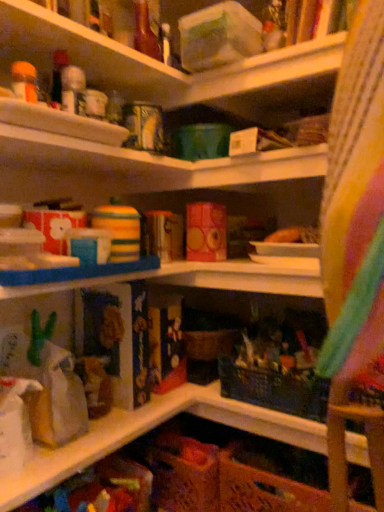
Question: Is brown paper bag at lower left shorter than orange woven basket at lower center?

Choices:
 (A) yes
 (B) no

Answer: (A)

Question: Considering the relative positions of brown paper bag at lower left and orange woven basket at lower center in the image provided, is brown paper bag at lower left to the left of orange woven basket at lower center from the viewer's perspective?

Choices:
 (A) no
 (B) yes

Answer: (B)

Question: Does brown paper bag at lower left have a larger size compared to orange woven basket at lower center?

Choices:
 (A) no
 (B) yes

Answer: (A)

Question: Is brown paper bag at lower left next to orange woven basket at lower center and touching it?

Choices:
 (A) no
 (B) yes

Answer: (A)

Question: Does brown paper bag at lower left have a smaller size compared to orange woven basket at lower center?

Choices:
 (A) yes
 (B) no

Answer: (A)

Question: Is brown paper bag at lower left further to camera compared to orange woven basket at lower center?

Choices:
 (A) no
 (B) yes

Answer: (A)

Question: Are orange woven basket at lower center and brown paper bag at lower left far apart?

Choices:
 (A) yes
 (B) no

Answer: (B)

Question: Does orange woven basket at lower center have a smaller size compared to brown paper bag at lower left?

Choices:
 (A) no
 (B) yes

Answer: (A)

Question: Is orange woven basket at lower center to the right of brown paper bag at lower left from the viewer's perspective?

Choices:
 (A) no
 (B) yes

Answer: (B)

Question: Is orange woven basket at lower center positioned in front of brown paper bag at lower left?

Choices:
 (A) yes
 (B) no

Answer: (B)

Question: Does orange woven basket at lower center have a greater width compared to brown paper bag at lower left?

Choices:
 (A) no
 (B) yes

Answer: (B)

Question: Is orange woven basket at lower center further to camera compared to brown paper bag at lower left?

Choices:
 (A) yes
 (B) no

Answer: (A)

Question: Considering the positions of orange woven basket at lower center and brown paper bag at lower left in the image, is orange woven basket at lower center bigger or smaller than brown paper bag at lower left?

Choices:
 (A) small
 (B) big

Answer: (B)